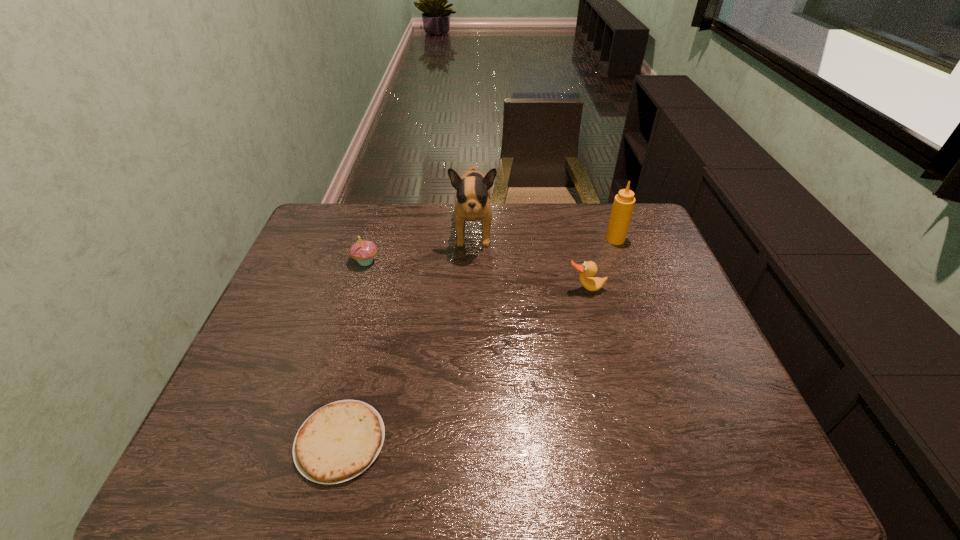
The width and height of the screenshot is (960, 540). I want to click on vacant space situated on the front of the condiment, so [x=636, y=297].

Where is `vacant region located 0.130m on the back of the cupcake`? Image resolution: width=960 pixels, height=540 pixels. vacant region located 0.130m on the back of the cupcake is located at coordinates (375, 229).

The height and width of the screenshot is (540, 960). Identify the location of vacant space located 0.310m on the beak of the second nearest object. (612, 387).

Where is `free space located on the back of the tortilla`? This screenshot has width=960, height=540. free space located on the back of the tortilla is located at coordinates (376, 298).

The image size is (960, 540). What are the coordinates of `puppy located in the far edge section of the desktop` in the screenshot? It's located at (473, 194).

Image resolution: width=960 pixels, height=540 pixels. What are the coordinates of `condiment present at the far edge` in the screenshot? It's located at (624, 201).

This screenshot has width=960, height=540. Find the location of `object that is at the near edge`. object that is at the near edge is located at coordinates (339, 441).

Where is `object situated at the right edge`? The image size is (960, 540). object situated at the right edge is located at coordinates (624, 201).

Where is `object that is at the far right corner`? The height and width of the screenshot is (540, 960). object that is at the far right corner is located at coordinates (624, 201).

Image resolution: width=960 pixels, height=540 pixels. Find the location of `free region at the far edge of the desktop`. free region at the far edge of the desktop is located at coordinates (420, 214).